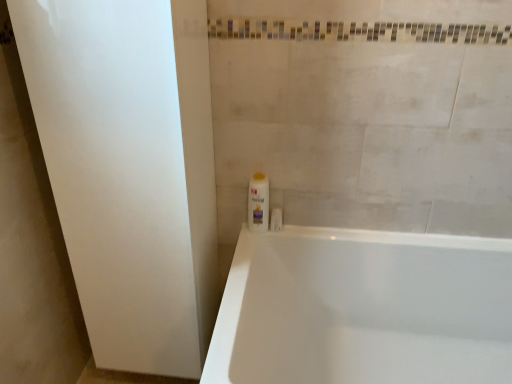
At what (x,y) coordinates should I click in order to perform the action: click on white plastic bottle at center. Please return your answer as a coordinate pair (x, y). The height and width of the screenshot is (384, 512). Looking at the image, I should click on (258, 203).

The image size is (512, 384). Describe the element at coordinates (364, 309) in the screenshot. I see `white glossy bathtub at lower right` at that location.

Image resolution: width=512 pixels, height=384 pixels. I want to click on white glossy bathtub at lower right, so click(x=364, y=309).

What do you see at coordinates (128, 168) in the screenshot?
I see `white matte screen door at left` at bounding box center [128, 168].

What are the coordinates of `white plastic bottle at center` in the screenshot? It's located at [x=258, y=203].

Measure the distance between white matte screen door at left and white plastic bottle at center.

They are 19.15 inches apart.

Which object is closer to the camera, white matte screen door at left or white plastic bottle at center?

white matte screen door at left.

Is white matte screen door at left positioned with its back to white plastic bottle at center?

white matte screen door at left is not turned away from white plastic bottle at center.

Measure the distance from white glossy bathtub at lower right to white matte screen door at left.

They are 20.96 inches apart.

Is white glossy bathtub at lower right oriented away from white matte screen door at left?

white glossy bathtub at lower right is not turned away from white matte screen door at left.

From the picture: From a real-world perspective, is white glossy bathtub at lower right positioned above or below white matte screen door at left?

Clearly, from a real-world perspective, white glossy bathtub at lower right is below white matte screen door at left.

Between white glossy bathtub at lower right and white matte screen door at left, which one has larger width?

Wider between the two is white glossy bathtub at lower right.

Is white glossy bathtub at lower right facing away from white plastic bottle at center?

Yes, white plastic bottle at center is at the back of white glossy bathtub at lower right.

From the image's perspective, is white glossy bathtub at lower right positioned above or below white plastic bottle at center?

Clearly, from the image's perspective, white glossy bathtub at lower right is below white plastic bottle at center.

Does white glossy bathtub at lower right come behind white plastic bottle at center?

No, it is not.

From the image's perspective, does white matte screen door at left appear lower than white glossy bathtub at lower right?

No.

Considering the relative sizes of white matte screen door at left and white glossy bathtub at lower right in the image provided, is white matte screen door at left taller than white glossy bathtub at lower right?

Yes, white matte screen door at left is taller than white glossy bathtub at lower right.

In the scene shown: Does white matte screen door at left have a lesser width compared to white glossy bathtub at lower right?

Yes, white matte screen door at left is thinner than white glossy bathtub at lower right.

Is white matte screen door at left looking in the opposite direction of white glossy bathtub at lower right?

No, white glossy bathtub at lower right is not at the back of white matte screen door at left.

Is white plastic bottle at center closer to the viewer compared to white glossy bathtub at lower right?

No, white plastic bottle at center is further to the viewer.

Between white plastic bottle at center and white glossy bathtub at lower right, which one appears on the left side from the viewer's perspective?

white plastic bottle at center is more to the left.

From the image's perspective, is white plastic bottle at center positioned above or below white glossy bathtub at lower right?

white plastic bottle at center is above white glossy bathtub at lower right.

Which object is positioned more to the left, white plastic bottle at center or white matte screen door at left?

From the viewer's perspective, white matte screen door at left appears more on the left side.

What's the angular difference between white plastic bottle at center and white matte screen door at left's facing directions?

The facing directions of white plastic bottle at center and white matte screen door at left are 0.0538 degrees apart.

In the image, there is a white plastic bottle at center. Where is `screen door below it (from a real-world perspective)`? screen door below it (from a real-world perspective) is located at coordinates (128, 168).

Consider the image. Is white plastic bottle at center thinner than white matte screen door at left?

Yes, white plastic bottle at center is thinner than white matte screen door at left.

Identify the location of screen door below the white plastic bottle at center (from a real-world perspective). The height and width of the screenshot is (384, 512). (128, 168).

I want to click on screen door above the white glossy bathtub at lower right (from the image's perspective), so click(128, 168).

Estimate the real-world distances between objects in this image. Which object is further from white matte screen door at left, white plastic bottle at center or white glossy bathtub at lower right?

Among the two, white glossy bathtub at lower right is located further to white matte screen door at left.

When comparing their distances from white glossy bathtub at lower right, does white matte screen door at left or white plastic bottle at center seem further?

Among the two, white matte screen door at left is located further to white glossy bathtub at lower right.

From the picture: When comparing their distances from white plastic bottle at center, does white matte screen door at left or white glossy bathtub at lower right seem further?

white matte screen door at left is positioned further to the anchor white plastic bottle at center.

Which object lies further to the anchor point white plastic bottle at center, white glossy bathtub at lower right or white matte screen door at left?

white matte screen door at left is positioned further to the anchor white plastic bottle at center.

Estimate the real-world distances between objects in this image. Which object is closer to white matte screen door at left, white glossy bathtub at lower right or white plastic bottle at center?

white plastic bottle at center lies closer to white matte screen door at left than the other object.

Estimate the real-world distances between objects in this image. Which object is further from white glossy bathtub at lower right, white plastic bottle at center or white matte screen door at left?

white matte screen door at left is positioned further to the anchor white glossy bathtub at lower right.

At what (x,y) coordinates should I click in order to perform the action: click on toiletry situated between white matte screen door at left and white glossy bathtub at lower right from left to right. Please return your answer as a coordinate pair (x, y). The height and width of the screenshot is (384, 512). Looking at the image, I should click on (258, 203).